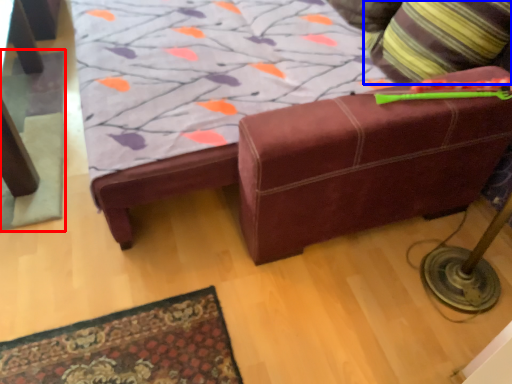
Question: Which object is closer to the camera taking this photo, mat (highlighted by a red box) or throw pillow (highlighted by a blue box)?

Choices:
 (A) mat
 (B) throw pillow

Answer: (B)